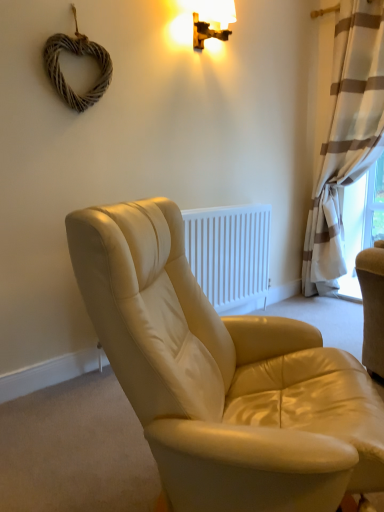
Question: Should I look upward or downward to see woven wood heart at upper left?

Choices:
 (A) up
 (B) down

Answer: (A)

Question: Is white striped curtain at right a part of wooden wall sconce at upper center?

Choices:
 (A) yes
 (B) no

Answer: (B)

Question: Can you confirm if wooden wall sconce at upper center is positioned to the right of white striped curtain at right?

Choices:
 (A) yes
 (B) no

Answer: (B)

Question: Considering the relative positions of wooden wall sconce at upper center and white striped curtain at right in the image provided, is wooden wall sconce at upper center behind white striped curtain at right?

Choices:
 (A) no
 (B) yes

Answer: (A)

Question: From the image's perspective, does wooden wall sconce at upper center appear higher than white striped curtain at right?

Choices:
 (A) yes
 (B) no

Answer: (A)

Question: Can you confirm if wooden wall sconce at upper center is wider than white striped curtain at right?

Choices:
 (A) no
 (B) yes

Answer: (A)

Question: Is there a large distance between wooden wall sconce at upper center and white striped curtain at right?

Choices:
 (A) yes
 (B) no

Answer: (A)

Question: Does woven wood heart at upper left have a larger size compared to leather chair at center?

Choices:
 (A) no
 (B) yes

Answer: (A)

Question: Is woven wood heart at upper left wider than leather chair at center?

Choices:
 (A) no
 (B) yes

Answer: (A)

Question: From a real-world perspective, is woven wood heart at upper left under leather chair at center?

Choices:
 (A) no
 (B) yes

Answer: (A)

Question: Can you confirm if woven wood heart at upper left is thinner than leather chair at center?

Choices:
 (A) yes
 (B) no

Answer: (A)

Question: Is leather chair at center at the back of woven wood heart at upper left?

Choices:
 (A) yes
 (B) no

Answer: (B)

Question: Are woven wood heart at upper left and leather chair at center located far from each other?

Choices:
 (A) yes
 (B) no

Answer: (A)

Question: Is leather chair at center turned away from white striped curtain at right?

Choices:
 (A) no
 (B) yes

Answer: (A)